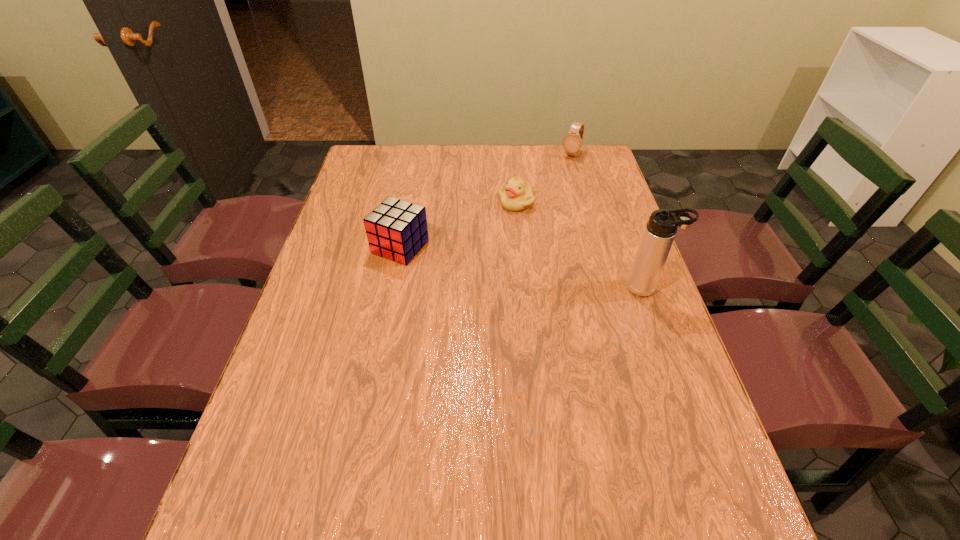
In order to click on vacant position in the image that satisfies the following two spatial constraints: 1. on the front side of the rightmost object; 2. on the handle side of the farthest object in this screenshot , I will do `click(610, 288)`.

Where is `free spot that satisfies the following two spatial constraints: 1. on the back side of the second object from left to right; 2. on the right side of the farthest object`? free spot that satisfies the following two spatial constraints: 1. on the back side of the second object from left to right; 2. on the right side of the farthest object is located at coordinates (512, 155).